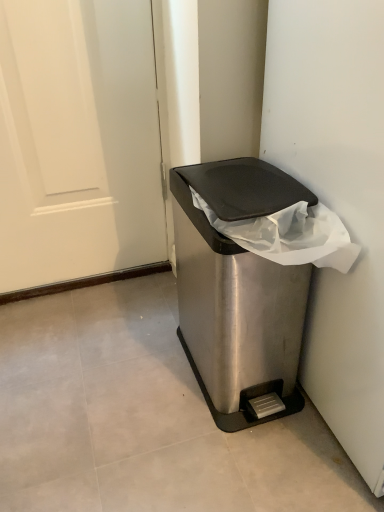
In order to click on free space above satin silver trash can at lower right (from a real-world perspective) in this screenshot , I will do `click(254, 182)`.